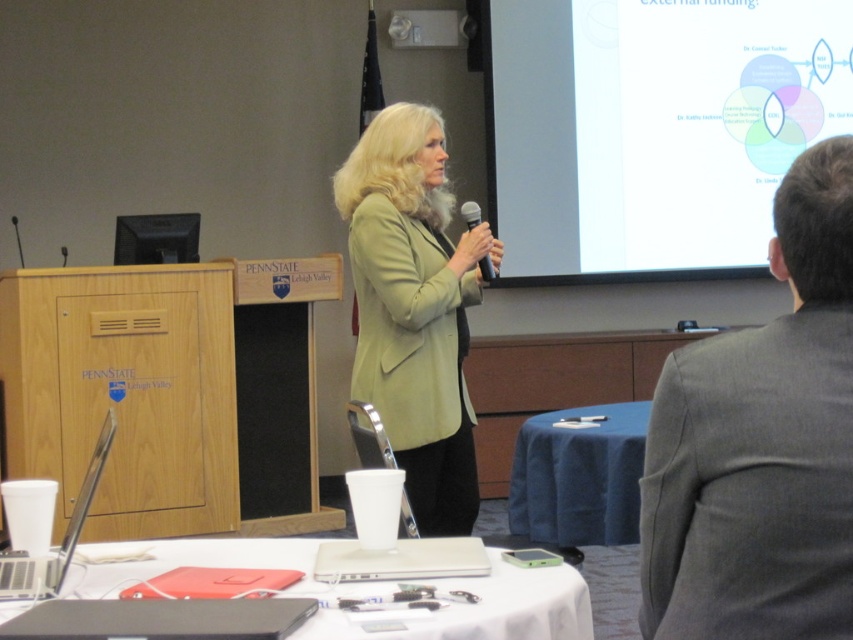
Is point (814, 257) closer to camera compared to point (444, 628)?

Yes, it is.

Is gray suit at upper right smaller than white plastic cup at lower center?

Correct, gray suit at upper right occupies less space than white plastic cup at lower center.

Between point (674, 572) and point (486, 582), which one is positioned in front?

Point (674, 572)

Locate an element on the screen. gray suit at upper right is located at coordinates (761, 444).

Can you confirm if white plastic cup at lower center is positioned above blue fabric table at center?

Incorrect, white plastic cup at lower center is not positioned above blue fabric table at center.

Does white plastic cup at lower center have a greater height compared to blue fabric table at center?

No.

The width and height of the screenshot is (853, 640). I want to click on white plastic cup at lower center, so click(x=485, y=609).

I want to click on white plastic cup at lower center, so click(485, 609).

Between point (577, 74) and point (374, 282), which one is positioned behind?

Point (577, 74)

Between white glossy projection screen at upper right and green matte blazer at center, which one has more height?

Standing taller between the two is white glossy projection screen at upper right.

Describe the element at coordinates (653, 128) in the screenshot. The height and width of the screenshot is (640, 853). I see `white glossy projection screen at upper right` at that location.

I want to click on white glossy projection screen at upper right, so click(x=653, y=128).